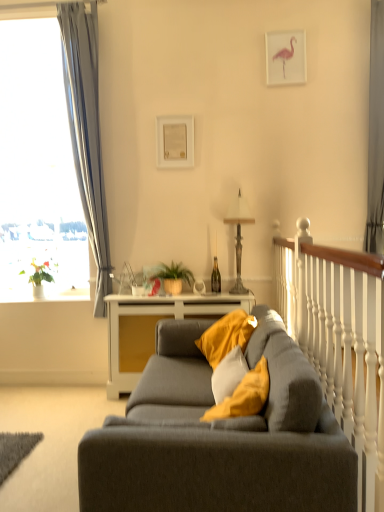
Looking at this image, what is the approximate height of soft yellow cushion at center?

soft yellow cushion at center is 50.32 centimeters tall.

You are a GUI agent. You are given a task and a screenshot of the screen. Output one action in this format:
    pyautogui.click(x=<x>, y=<y>)
    Task: Click on the silky gray curtain at left, marked as the second curtain in a right-to-left arrangement
    
    Given the screenshot: What is the action you would take?
    pyautogui.click(x=86, y=132)

Measure the distance between gray fabric curtain at right, which appears as the 2th curtain when viewed from the left, and camera.

gray fabric curtain at right, which appears as the 2th curtain when viewed from the left, and camera are 3.34 meters apart.

You are a GUI agent. You are given a task and a screenshot of the screen. Output one action in this format:
    pyautogui.click(x=<x>, y=<y>)
    Task: Click on the white glossy window at left
    
    Given the screenshot: What is the action you would take?
    pyautogui.click(x=37, y=168)

The image size is (384, 512). I want to click on white paper at upper center, which appears as the second picture frame when viewed from the front, so click(175, 141).

Describe the element at coordinates (219, 437) in the screenshot. I see `matte gray couch at center` at that location.

How much space does pink paper picture frame at upper center, acting as the 2th picture frame starting from the bottom, occupy vertically?

pink paper picture frame at upper center, acting as the 2th picture frame starting from the bottom, is 17.16 inches tall.

Image resolution: width=384 pixels, height=512 pixels. Identify the location of soft yellow cushion at center. (244, 396).

Considering the sizes of pink paper picture frame at upper center, acting as the 2th picture frame starting from the bottom, and metallic gray lamp at center in the image, is pink paper picture frame at upper center, acting as the 2th picture frame starting from the bottom, bigger or smaller than metallic gray lamp at center?

pink paper picture frame at upper center, acting as the 2th picture frame starting from the bottom, is smaller than metallic gray lamp at center.

Considering the relative positions of pink paper picture frame at upper center, the 1th picture frame in the right-to-left sequence, and metallic gray lamp at center in the image provided, is pink paper picture frame at upper center, the 1th picture frame in the right-to-left sequence, in front of metallic gray lamp at center?

No, pink paper picture frame at upper center, the 1th picture frame in the right-to-left sequence, is further to the viewer.

What's the angular difference between pink paper picture frame at upper center, the 1th picture frame in the right-to-left sequence, and metallic gray lamp at center's facing directions?

The facing directions of pink paper picture frame at upper center, the 1th picture frame in the right-to-left sequence, and metallic gray lamp at center are 0.0123 degrees apart.

Who is smaller, soft yellow cushion at center or green matte plant at left, which ranks as the first plant in back-to-front order?

Smaller between the two is green matte plant at left, which ranks as the first plant in back-to-front order.

Which is in front, point (213, 420) or point (48, 281)?

The point (213, 420) is more forward.

From the image's perspective, is soft yellow cushion at center on top of green matte plant at left, the second plant positioned from the front?

Actually, soft yellow cushion at center appears below green matte plant at left, the second plant positioned from the front, in the image.

Can you see soft yellow cushion at center touching green matte plant at left, the second plant positioned from the front?

No, soft yellow cushion at center is not next to green matte plant at left, the second plant positioned from the front.

Identify the location of table located underneath the soft yellow cushion at center (from a real-world perspective). This screenshot has width=384, height=512. (153, 329).

From the image's perspective, is soft yellow cushion at center located above or below white wood table at center?

Based on their image positions, soft yellow cushion at center is located above white wood table at center.

Considering the sizes of soft yellow cushion at center and white wood table at center in the image, is soft yellow cushion at center wider or thinner than white wood table at center?

Considering their sizes, soft yellow cushion at center looks slimmer than white wood table at center.

Is soft yellow cushion at center touching white wood table at center?

No, soft yellow cushion at center is not with white wood table at center.

Which of these two, soft yellow cushion at center or white paper at upper center, the first picture frame viewed from the back, stands taller?

With more height is soft yellow cushion at center.

Which of these two, soft yellow cushion at center or white paper at upper center, which ranks as the second picture frame in right-to-left order, is wider?

soft yellow cushion at center is wider.

Is soft yellow cushion at center not within white paper at upper center, the first picture frame viewed from the back?

soft yellow cushion at center is positioned outside white paper at upper center, the first picture frame viewed from the back.

Which is behind, point (232, 398) or point (177, 117)?

Point (177, 117)

Based on the photo, is soft yellow cushion at center located outside gray fabric curtain at right, which is counted as the 1th curtain, starting from the right?

soft yellow cushion at center lies outside gray fabric curtain at right, which is counted as the 1th curtain, starting from the right,'s area.

Is soft yellow cushion at center oriented towards gray fabric curtain at right, which appears as the 2th curtain when viewed from the left?

No.

Does soft yellow cushion at center have a lesser width compared to gray fabric curtain at right, which is counted as the 1th curtain, starting from the right?

No, soft yellow cushion at center is not thinner than gray fabric curtain at right, which is counted as the 1th curtain, starting from the right.

Considering the relative sizes of soft yellow cushion at center and gray fabric curtain at right, which appears as the 2th curtain when viewed from the left, in the image provided, is soft yellow cushion at center shorter than gray fabric curtain at right, which appears as the 2th curtain when viewed from the left,?

Correct, soft yellow cushion at center is not as tall as gray fabric curtain at right, which appears as the 2th curtain when viewed from the left.

Which is nearer, (227,407) or (166,287)?

Clearly, point (227,407) is closer to the camera than point (166,287).

You are a GUI agent. You are given a task and a screenshot of the screen. Output one action in this format:
    pyautogui.click(x=<x>, y=<y>)
    Task: Click on the pillow located below the green matte plant at center, placed as the first plant when sorted from right to left (from the image's perspective)
    Image resolution: width=384 pixels, height=512 pixels.
    Given the screenshot: What is the action you would take?
    pyautogui.click(x=244, y=396)

Is soft yellow cushion at center placed right next to green matte plant at center, the 1th plant positioned from the front?

No, soft yellow cushion at center is not making contact with green matte plant at center, the 1th plant positioned from the front.

Which is more to the right, soft yellow cushion at center or green matte plant at center, placed as the first plant when sorted from right to left?

soft yellow cushion at center is more to the right.

In the image, is matte gray couch at center positioned in front of or behind green matte plant at center, the 2th plant positioned from the back?

Visually, matte gray couch at center is located in front of green matte plant at center, the 2th plant positioned from the back.

What's the angular difference between matte gray couch at center and green matte plant at center, the 2th plant positioned from the back,'s facing directions?

89.3 degrees separate the facing orientations of matte gray couch at center and green matte plant at center, the 2th plant positioned from the back.

Considering the relative sizes of matte gray couch at center and green matte plant at center, the 1th plant positioned from the front, in the image provided, is matte gray couch at center thinner than green matte plant at center, the 1th plant positioned from the front,?

Incorrect, the width of matte gray couch at center is not less than that of green matte plant at center, the 1th plant positioned from the front.

Measure the distance from matte gray couch at center to green matte plant at center, the 1th plant positioned from the front.

The distance of matte gray couch at center from green matte plant at center, the 1th plant positioned from the front, is 1.70 meters.

Where is `picture frame that is the 2nd one when counting upward from the metallic gray lamp at center (from the image's perspective)`? The width and height of the screenshot is (384, 512). picture frame that is the 2nd one when counting upward from the metallic gray lamp at center (from the image's perspective) is located at coordinates (286, 57).

From a real-world perspective, which plant is the 2nd one above the soft yellow cushion at center? Please provide its 2D coordinates.

[(40, 273)]

Based on their spatial positions, is soft yellow cushion at center or white paper at upper center, which appears as the second picture frame when viewed from the front, closer to green matte plant at center, the 1th plant positioned from the front?

white paper at upper center, which appears as the second picture frame when viewed from the front.

Looking at the image, which one is located further to pink paper picture frame at upper center, positioned as the first picture frame in top-to-bottom order, white wood table at center or white paper at upper center, which appears as the second picture frame when viewed from the front?

white wood table at center is positioned further to the anchor pink paper picture frame at upper center, positioned as the first picture frame in top-to-bottom order.

Considering their positions, is green matte plant at left, which is the 1th plant from left to right, positioned further to white paper at upper center, which appears as the second picture frame when viewed from the front, than green matte plant at center, placed as the first plant when sorted from right to left?

The object further to white paper at upper center, which appears as the second picture frame when viewed from the front, is green matte plant at left, which is the 1th plant from left to right.

Looking at the image, which one is located further to gray fabric curtain at right, which is counted as the 1th curtain, starting from the right, white paper at upper center, which appears as the second picture frame when viewed from the front, or green matte plant at center, the 2th plant from the left?

The object further to gray fabric curtain at right, which is counted as the 1th curtain, starting from the right, is green matte plant at center, the 2th plant from the left.

Based on their spatial positions, is white wooden railing at right or soft yellow cushion at center closer to gray fabric curtain at right, which is counted as the 1th curtain, starting from the right?

Among the two, white wooden railing at right is located nearer to gray fabric curtain at right, which is counted as the 1th curtain, starting from the right.

Looking at the image, which one is located further to matte gray couch at center, silky gray curtain at left, the 1th curtain positioned from the left, or white wooden railing at right?

Among the two, silky gray curtain at left, the 1th curtain positioned from the left, is located further to matte gray couch at center.

From the image, which object appears to be farther from metallic gray lamp at center, white wood table at center or pink paper picture frame at upper center, acting as the 2th picture frame starting from the bottom?

pink paper picture frame at upper center, acting as the 2th picture frame starting from the bottom, lies further to metallic gray lamp at center than the other object.

Estimate the real-world distances between objects in this image. Which object is further from matte gray couch at center, white wooden railing at right or white glossy window at left?

Among the two, white glossy window at left is located further to matte gray couch at center.

Identify the location of table located between white wooden railing at right and pink paper picture frame at upper center, positioned as the first picture frame in top-to-bottom order, in the depth direction. The width and height of the screenshot is (384, 512). (153, 329).

Find the location of a particular element. This screenshot has width=384, height=512. lamp between matte gray couch at center and white glossy window at left from front to back is located at coordinates (239, 237).

Image resolution: width=384 pixels, height=512 pixels. Identify the location of plant between white wooden railing at right and white paper at upper center, which is the 2th picture frame in top-to-bottom order, from front to back. (172, 276).

At what (x,y) coordinates should I click in order to perform the action: click on curtain positioned between matte gray couch at center and metallic gray lamp at center from near to far. Please return your answer as a coordinate pair (x, y). Looking at the image, I should click on point(376,134).